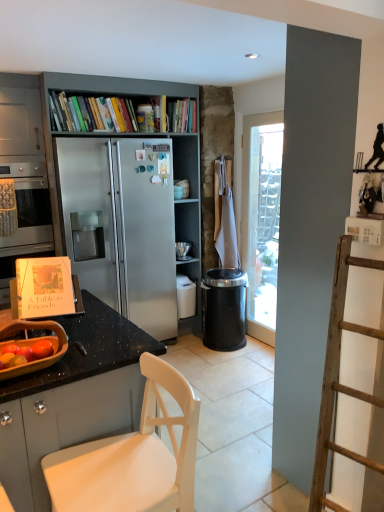
Question: Can you confirm if black plastic trash can at center-right is shorter than stainless steel oven at left?

Choices:
 (A) yes
 (B) no

Answer: (A)

Question: From the image's perspective, would you say black plastic trash can at center-right is shown under stainless steel oven at left?

Choices:
 (A) yes
 (B) no

Answer: (A)

Question: Is black plastic trash can at center-right surrounding stainless steel oven at left?

Choices:
 (A) yes
 (B) no

Answer: (B)

Question: Is black plastic trash can at center-right to the right of stainless steel oven at left from the viewer's perspective?

Choices:
 (A) yes
 (B) no

Answer: (A)

Question: Does black plastic trash can at center-right have a greater height compared to stainless steel oven at left?

Choices:
 (A) yes
 (B) no

Answer: (B)

Question: Can you confirm if black plastic trash can at center-right is wider than stainless steel oven at left?

Choices:
 (A) yes
 (B) no

Answer: (B)

Question: Considering the relative sizes of black glossy shelf at upper right and white matte chair at lower left in the image provided, is black glossy shelf at upper right taller than white matte chair at lower left?

Choices:
 (A) yes
 (B) no

Answer: (B)

Question: Does black glossy shelf at upper right have a lesser width compared to white matte chair at lower left?

Choices:
 (A) yes
 (B) no

Answer: (A)

Question: Is black glossy shelf at upper right at the left side of white matte chair at lower left?

Choices:
 (A) yes
 (B) no

Answer: (B)

Question: Is black glossy shelf at upper right further to the viewer compared to white matte chair at lower left?

Choices:
 (A) no
 (B) yes

Answer: (B)

Question: Is black glossy shelf at upper right outside of white matte chair at lower left?

Choices:
 (A) no
 (B) yes

Answer: (B)

Question: Considering the relative sizes of black glossy shelf at upper right and white matte chair at lower left in the image provided, is black glossy shelf at upper right shorter than white matte chair at lower left?

Choices:
 (A) yes
 (B) no

Answer: (A)

Question: From the image's perspective, is metallic gray bookcase at center beneath black plastic trash can at center-right?

Choices:
 (A) yes
 (B) no

Answer: (B)